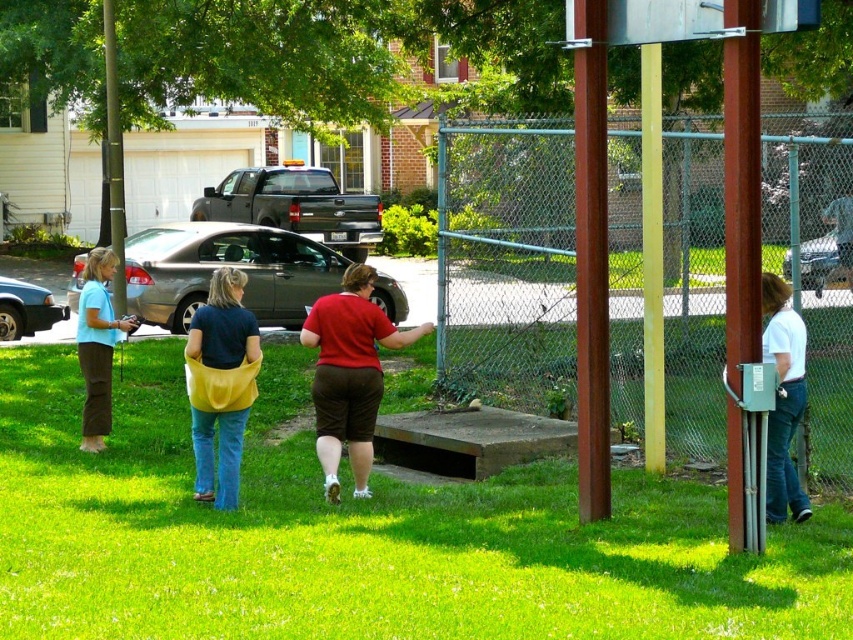
Question: Which of the following is the closest to the observer?

Choices:
 (A) (219, 362)
 (B) (602, 241)

Answer: (B)

Question: Which point appears closest to the camera in this image?

Choices:
 (A) (236, 476)
 (B) (90, 330)

Answer: (A)

Question: Is red matte shorts at center behind white cotton shirt at right?

Choices:
 (A) yes
 (B) no

Answer: (A)

Question: Is red matte shorts at center above blue denim jeans at center?

Choices:
 (A) no
 (B) yes

Answer: (A)

Question: Which object is the farthest from the red matte shorts at center?

Choices:
 (A) metallic silver basketball hoop at right
 (B) matte blue shirt at left

Answer: (B)

Question: Is metallic silver basketball hoop at right above red matte shorts at center?

Choices:
 (A) yes
 (B) no

Answer: (A)